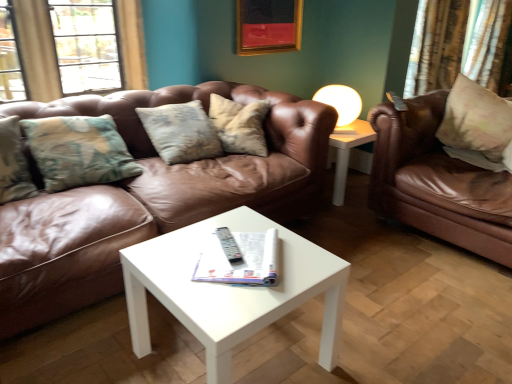
Question: From the image's perspective, is brown leather couch at center, which is counted as the 2th studio couch, starting from the right, positioned above or below white matte lampshade at upper center?

Choices:
 (A) below
 (B) above

Answer: (A)

Question: In terms of size, does brown leather couch at center, which is counted as the 2th studio couch, starting from the right, appear bigger or smaller than white matte lampshade at upper center?

Choices:
 (A) small
 (B) big

Answer: (B)

Question: Which object is positioned closest to the black plastic remote at center?

Choices:
 (A) floral fabric pillow at right
 (B) brown leather couch at center, which is counted as the 2th studio couch, starting from the right
 (C) white paper magazine at center
 (D) gold textured curtain at upper right
 (E) white glossy coffee table at center

Answer: (C)

Question: Based on their relative distances, which object is nearer to the black plastic remote at center?

Choices:
 (A) brown leather couch at right, the 2th studio couch in the left-to-right sequence
 (B) floral fabric pillow at right
 (C) brown leather couch at center, which is counted as the 2th studio couch, starting from the right
 (D) white paper magazine at center
 (E) white matte lampshade at upper center

Answer: (D)